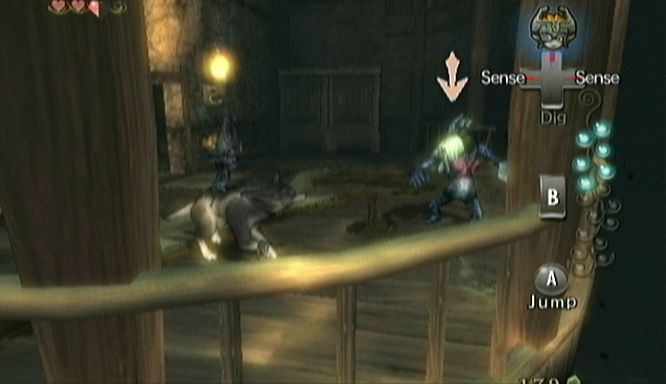
Locate an element on the screen. The image size is (666, 384). table is located at coordinates (350, 170).